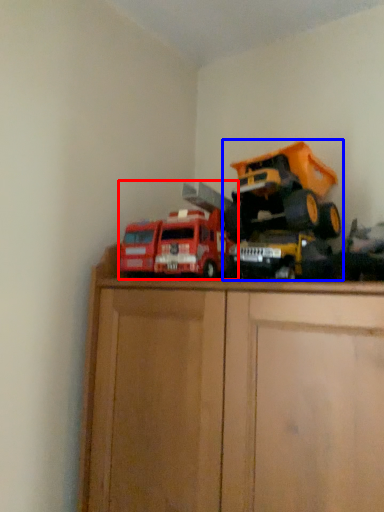
Question: Among these objects, which one is farthest to the camera, toy (highlighted by a red box) or toy (highlighted by a blue box)?

Choices:
 (A) toy
 (B) toy

Answer: (A)